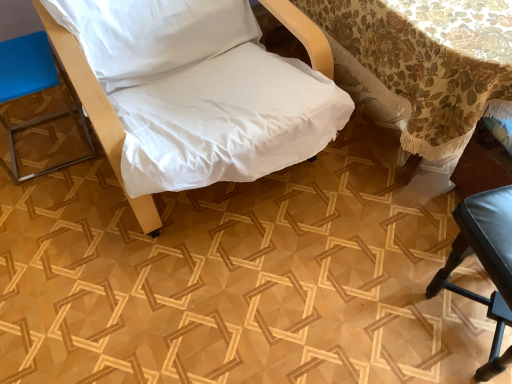
This screenshot has height=384, width=512. In order to click on vacant region to the left of black leather chair at lower right, which is the 1th furniture from right to left in this screenshot , I will do `click(377, 310)`.